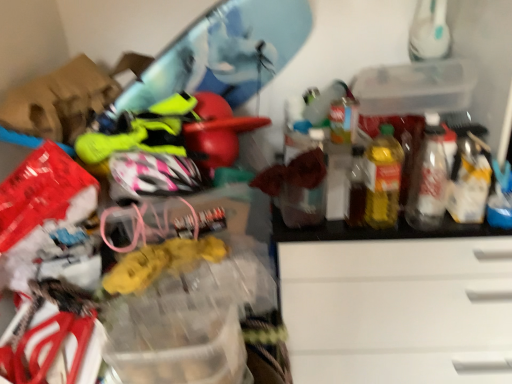
Question: Is transparent plastic storage box at upper right bigger than yellow translucent bottle at right, which is the second bottle from right to left?

Choices:
 (A) yes
 (B) no

Answer: (A)

Question: Is the depth of transparent plastic storage box at upper right greater than that of yellow translucent bottle at right, which is the second bottle from right to left?

Choices:
 (A) no
 (B) yes

Answer: (B)

Question: Considering the relative sizes of transparent plastic storage box at upper right and yellow translucent bottle at right, which ranks as the 1th bottle in left-to-right order, in the image provided, is transparent plastic storage box at upper right shorter than yellow translucent bottle at right, which ranks as the 1th bottle in left-to-right order,?

Choices:
 (A) yes
 (B) no

Answer: (A)

Question: Could you tell me if transparent plastic storage box at upper right is facing yellow translucent bottle at right, which ranks as the 1th bottle in left-to-right order?

Choices:
 (A) yes
 (B) no

Answer: (B)

Question: Does transparent plastic storage box at upper right have a greater height compared to yellow translucent bottle at right, which is the second bottle from right to left?

Choices:
 (A) yes
 (B) no

Answer: (B)

Question: Considering the relative positions of transparent plastic storage box at upper right and yellow translucent bottle at right, which ranks as the 1th bottle in left-to-right order, in the image provided, is transparent plastic storage box at upper right to the left of yellow translucent bottle at right, which ranks as the 1th bottle in left-to-right order, from the viewer's perspective?

Choices:
 (A) no
 (B) yes

Answer: (A)

Question: Is translucent plastic bottle at right, which is counted as the 1th bottle, starting from the right, far from yellow translucent bottle at right, which ranks as the 1th bottle in left-to-right order?

Choices:
 (A) no
 (B) yes

Answer: (A)

Question: Can you confirm if translucent plastic bottle at right, which is counted as the 1th bottle, starting from the right, is shorter than yellow translucent bottle at right, which is the second bottle from right to left?

Choices:
 (A) no
 (B) yes

Answer: (B)

Question: From the image's perspective, would you say translucent plastic bottle at right, positioned as the second bottle in left-to-right order, is positioned over yellow translucent bottle at right, which ranks as the 1th bottle in left-to-right order?

Choices:
 (A) yes
 (B) no

Answer: (A)

Question: Is yellow translucent bottle at right, which ranks as the 1th bottle in left-to-right order, completely or partially inside translucent plastic bottle at right, which is counted as the 1th bottle, starting from the right?

Choices:
 (A) yes
 (B) no

Answer: (B)

Question: Considering the relative positions of translucent plastic bottle at right, positioned as the second bottle in left-to-right order, and yellow translucent bottle at right, which ranks as the 1th bottle in left-to-right order, in the image provided, is translucent plastic bottle at right, positioned as the second bottle in left-to-right order, to the right of yellow translucent bottle at right, which ranks as the 1th bottle in left-to-right order, from the viewer's perspective?

Choices:
 (A) no
 (B) yes

Answer: (B)

Question: Can you confirm if translucent plastic bottle at right, positioned as the second bottle in left-to-right order, is wider than yellow translucent bottle at right, which ranks as the 1th bottle in left-to-right order?

Choices:
 (A) no
 (B) yes

Answer: (A)

Question: From a real-world perspective, is yellow translucent bottle at right, which is the second bottle from right to left, positioned over transparent plastic storage box at upper right based on gravity?

Choices:
 (A) no
 (B) yes

Answer: (A)